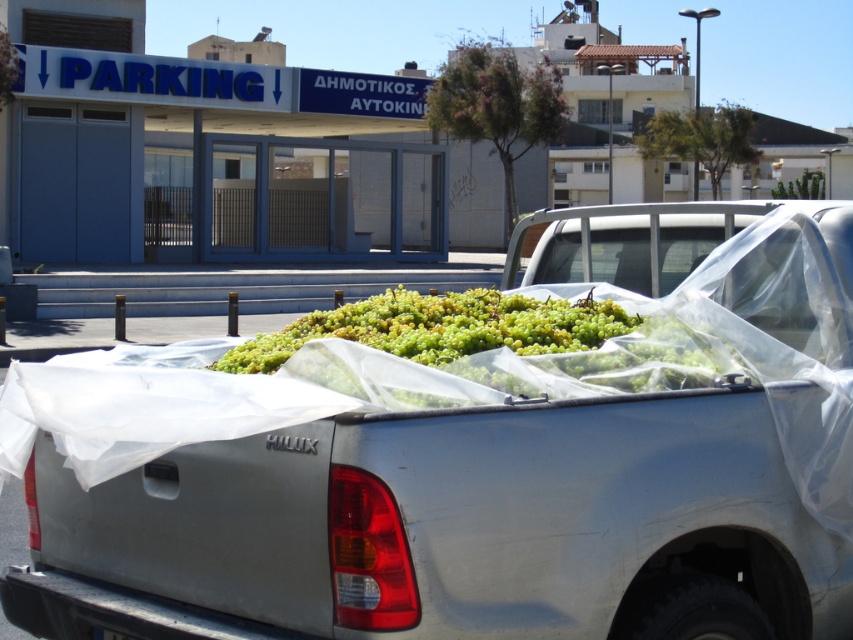
You are a delivery driver who needs to unload the green matte grapes at center from the white matte truck at center. Which direction should you move the grapes to first? Please consider the truck and grapes positions.

The white matte truck at center is below green matte grapes at center, so you should move the grapes downward to unload them from the white matte truck at center.

You are a delivery driver who needs to load more green matte grapes at center into the white matte truck at center. Given that the truck is already partially filled, can you estimate if there is enough space left in the truck bed to accommodate additional grapes?

The white matte truck at center has a larger size compared to green matte grapes at center, so there is likely sufficient space remaining in the truck bed to accommodate additional grapes.